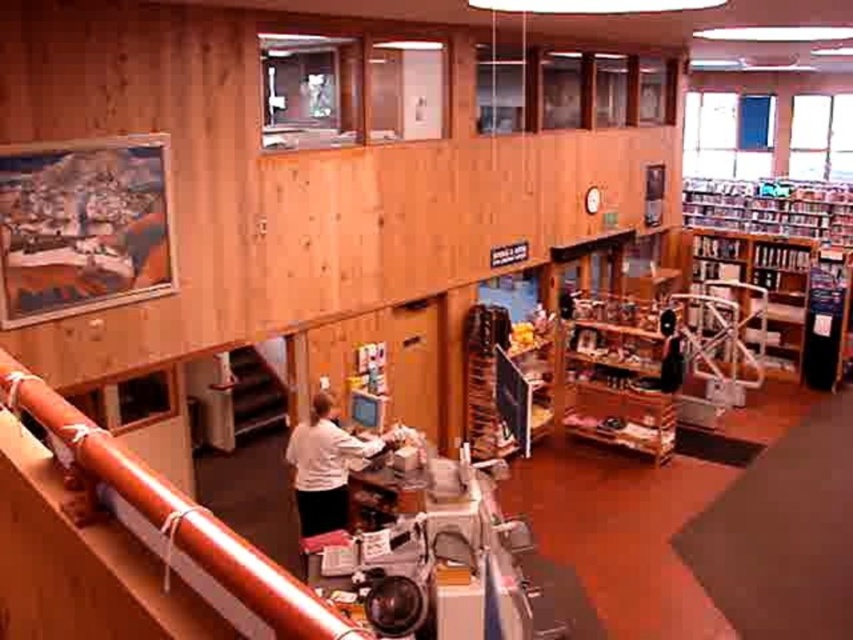
Question: Is the position of wooden bookshelf at right more distant than that of white matte shirt at center?

Choices:
 (A) yes
 (B) no

Answer: (A)

Question: Does brown polished wood rail at lower left appear on the left side of wooden shelves at center?

Choices:
 (A) yes
 (B) no

Answer: (A)

Question: Which point is closer to the camera?

Choices:
 (A) (602, 429)
 (B) (300, 428)
 (C) (779, 321)

Answer: (B)

Question: Which of these objects is positioned farthest from the wooden shelves at center?

Choices:
 (A) brown polished wood rail at lower left
 (B) wooden bookshelf at right
 (C) white matte shirt at center

Answer: (A)

Question: Does wooden shelves at center appear on the left side of white matte shirt at center?

Choices:
 (A) yes
 (B) no

Answer: (B)

Question: Which of the following is the farthest from the observer?

Choices:
 (A) (364, 458)
 (B) (612, 438)
 (C) (747, 294)
 (D) (100, 628)

Answer: (C)